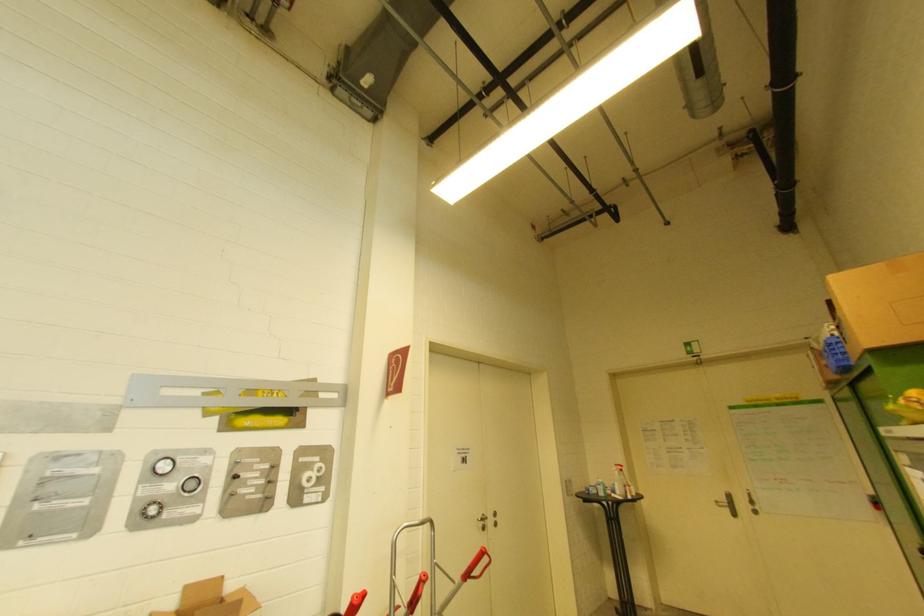
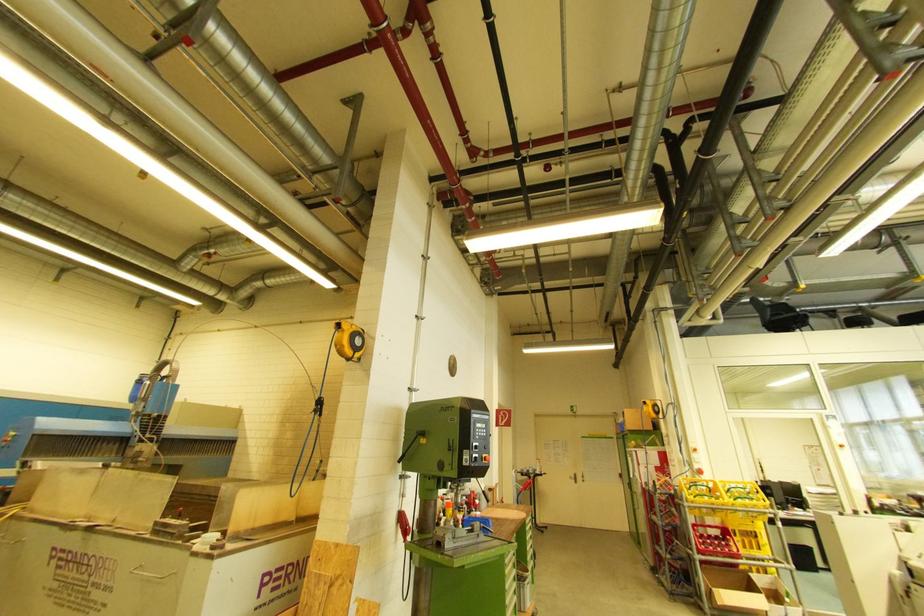
The point at (724, 500) is marked in the first image. Where is the corresponding point in the second image?

(575, 477)